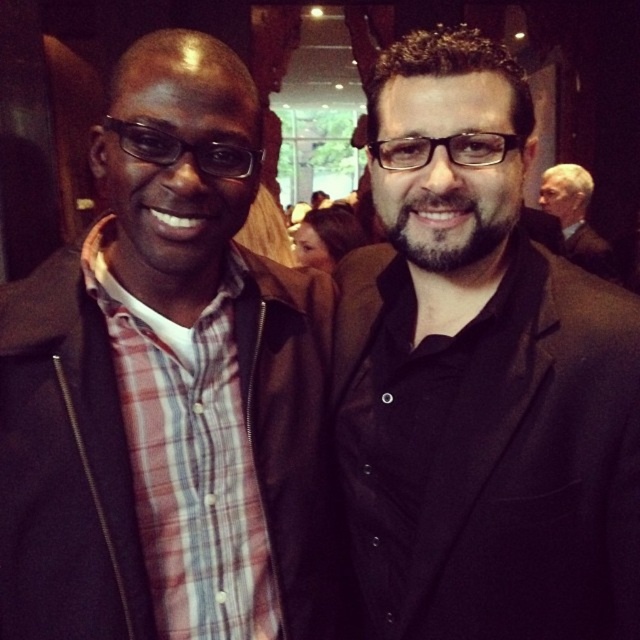
Who is higher up, plaid shirt at left or transparent plastic glasses at center?

Positioned higher is transparent plastic glasses at center.

Between plaid shirt at left and transparent plastic glasses at center, which one has less height?

Standing shorter between the two is transparent plastic glasses at center.

This screenshot has width=640, height=640. Identify the location of plaid shirt at left. (168, 388).

Image resolution: width=640 pixels, height=640 pixels. What do you see at coordinates (168, 388) in the screenshot?
I see `plaid shirt at left` at bounding box center [168, 388].

Which is above, plaid shirt at left or black plastic glasses at left?

black plastic glasses at left is above.

Between point (188, 307) and point (129, 147), which one is positioned behind?

Positioned behind is point (188, 307).

The image size is (640, 640). I want to click on plaid shirt at left, so click(168, 388).

Does black plastic glasses at left appear on the left side of transparent plastic glasses at center?

Yes, black plastic glasses at left is to the left of transparent plastic glasses at center.

Is point (248, 156) behind point (483, 148)?

Yes, point (248, 156) is behind point (483, 148).

Identify the location of black plastic glasses at left. (182, 148).

Where is `black plastic glasses at left`? This screenshot has height=640, width=640. black plastic glasses at left is located at coordinates (182, 148).